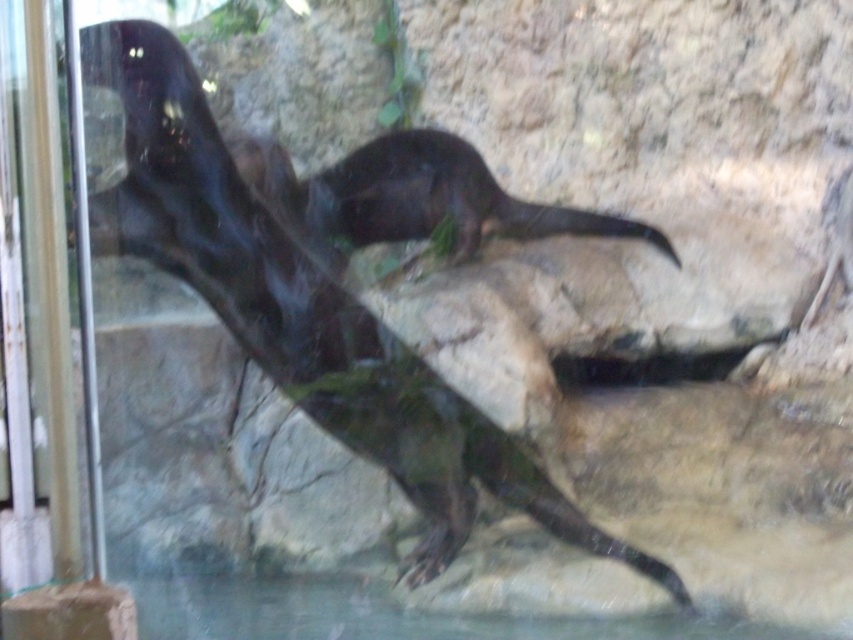
You are a zookeeper observing the enclosure. You notice a specific point marked at coordinates [332,282]. Which animal in the enclosure is this point located on?

The point at coordinates [332,282] is located on the shiny black otter at center.